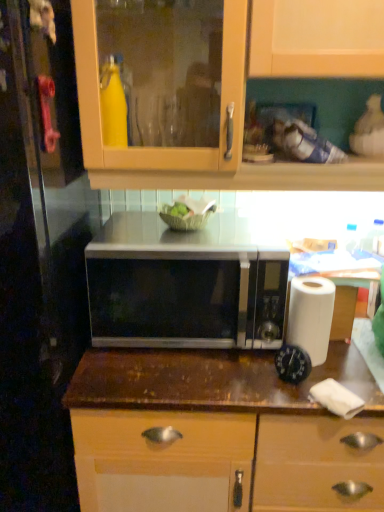
Identify the location of blank space situated above satin silver microwave at center (from a real-world perspective). This screenshot has height=512, width=384. (207, 234).